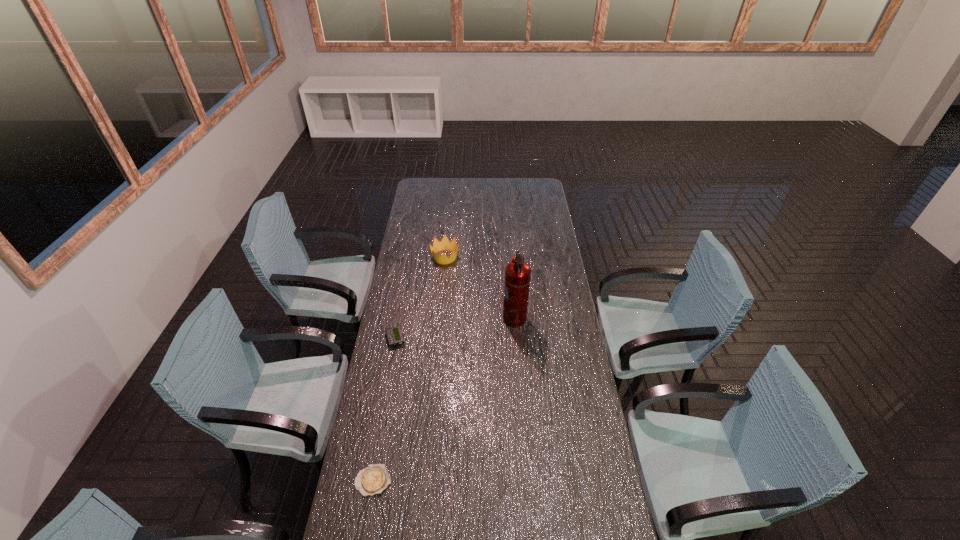
Locate an element on the screen. free space that satisfies the following two spatial constraints: 1. on the nozzle side of the tallest object; 2. on the front side of the nearest object is located at coordinates (527, 481).

Where is `blank space that satisfies the following two spatial constraints: 1. on the back side of the second object from right to left; 2. on the right side of the second shortest object`? The image size is (960, 540). blank space that satisfies the following two spatial constraints: 1. on the back side of the second object from right to left; 2. on the right side of the second shortest object is located at coordinates (410, 257).

Where is `vacant space that satisfies the following two spatial constraints: 1. on the nozzle side of the fire extinguisher; 2. on the front side of the beeper`? This screenshot has height=540, width=960. vacant space that satisfies the following two spatial constraints: 1. on the nozzle side of the fire extinguisher; 2. on the front side of the beeper is located at coordinates (516, 339).